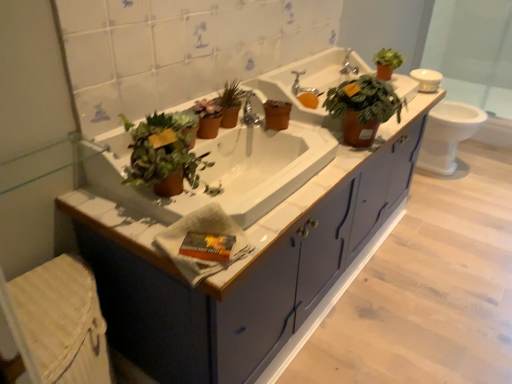
Image resolution: width=512 pixels, height=384 pixels. I want to click on white textured hand towel at center, so click(202, 231).

Identify the location of matte brown pot at center. (163, 138).

You are a GUI agent. You are given a task and a screenshot of the screen. Output one action in this format:
    pyautogui.click(x=<x>, y=<y>)
    Task: Click on the matte blue cabinet at center
    The image size is (512, 384).
    Given the screenshot: What is the action you would take?
    pyautogui.click(x=279, y=294)

Describe the element at coordinates (207, 118) in the screenshot. I see `green matte plant at center, the 2th houseplant in the front-to-back sequence` at that location.

Locate an element on the screen. The width and height of the screenshot is (512, 384). silver metallic faucet at center, the first faucet from the left is located at coordinates pos(302,87).

Does point (295, 160) come farther from viewer compared to point (206, 267)?

Yes, it is behind point (206, 267).

From a real-world perspective, who is located higher, white glossy sink at center, which is the 1th sink in front-to-back order, or white textured hand towel at center?

white textured hand towel at center, from a real-world perspective.

Is white glossy sink at center, which is the 1th sink in front-to-back order, thinner than white textured hand towel at center?

No, white glossy sink at center, which is the 1th sink in front-to-back order, is not thinner than white textured hand towel at center.

From the image's perspective, which is above, white glossy sink at center, which ranks as the second sink in back-to-front order, or white textured hand towel at center?

white glossy sink at center, which ranks as the second sink in back-to-front order, appears higher in the image.

Would you say matte blue cabinet at center is inside or outside matte blue cabinet at center?

matte blue cabinet at center is outside matte blue cabinet at center.

Is matte blue cabinet at center touching matte blue cabinet at center?

Yes, matte blue cabinet at center is in contact with matte blue cabinet at center.

How different are the orientations of matte blue cabinet at center and matte blue cabinet at center in degrees?

They differ by 0.00384 degrees in their facing directions.

Is matte blue cabinet at center smaller than matte blue cabinet at center?

Correct, matte blue cabinet at center occupies less space than matte blue cabinet at center.

Could matte blue cabinet at center be considered to be inside white glossy sink at center, which is the 1th sink in front-to-back order?

No.

Is white glossy sink at center, which is the 1th sink in front-to-back order, in front of or behind matte blue cabinet at center in the image?

white glossy sink at center, which is the 1th sink in front-to-back order, is in front of matte blue cabinet at center.

Is the surface of white glossy sink at center, which ranks as the second sink in back-to-front order, in direct contact with matte blue cabinet at center?

No, white glossy sink at center, which ranks as the second sink in back-to-front order, is not with matte blue cabinet at center.

Is white glossy sink at center, which ranks as the second sink in back-to-front order, in front of or behind matte brown pot at center, which is counted as the second houseplant, starting from the back, in the image?

white glossy sink at center, which ranks as the second sink in back-to-front order, is positioned closer to the viewer than matte brown pot at center, which is counted as the second houseplant, starting from the back.

From the image's perspective, which houseplant is the 3rd one above the white glossy sink at center, which ranks as the second sink in back-to-front order? Please provide its 2D coordinates.

[(230, 103)]

Considering the sizes of objects white glossy sink at center, which ranks as the second sink in back-to-front order, and matte brown pot at center, which is counted as the second houseplant, starting from the back, in the image provided, who is bigger, white glossy sink at center, which ranks as the second sink in back-to-front order, or matte brown pot at center, which is counted as the second houseplant, starting from the back,?

white glossy sink at center, which ranks as the second sink in back-to-front order.

Is white glossy sink at center, which is the 1th sink in front-to-back order, thinner than matte brown pot at center, which ranks as the third houseplant in right-to-left order?

In fact, white glossy sink at center, which is the 1th sink in front-to-back order, might be wider than matte brown pot at center, which ranks as the third houseplant in right-to-left order.

Which point is more distant from viewer, [346,93] or [393,64]?

The point [393,64] is farther from the camera.

Is matte terracotta pot at upper right, positioned as the third houseplant in left-to-right order, beside green matte plant at upper right, the 4th houseplant viewed from the front?

matte terracotta pot at upper right, positioned as the third houseplant in left-to-right order, and green matte plant at upper right, the 4th houseplant viewed from the front, are not in contact.

Considering the relative sizes of matte terracotta pot at upper right, placed as the 2th houseplant when sorted from right to left, and green matte plant at upper right, the first houseplant viewed from the back, in the image provided, is matte terracotta pot at upper right, placed as the 2th houseplant when sorted from right to left, shorter than green matte plant at upper right, the first houseplant viewed from the back,?

In fact, matte terracotta pot at upper right, placed as the 2th houseplant when sorted from right to left, may be taller than green matte plant at upper right, the first houseplant viewed from the back.

From a real-world perspective, between matte terracotta pot at upper right, placed as the 2th houseplant when sorted from right to left, and green matte plant at upper right, the 4th houseplant viewed from the front, who is vertically higher?

In real-world perspective, matte terracotta pot at upper right, placed as the 2th houseplant when sorted from right to left, is above.

From the image's perspective, is silver metallic faucet at upper center, which is the 1th faucet from top to bottom, over matte brown pot at center?

Yes, from the image's perspective, silver metallic faucet at upper center, which is the 1th faucet from top to bottom, is above matte brown pot at center.

Which point is more forward, (x=351, y=71) or (x=166, y=129)?

The point (x=166, y=129) is more forward.

Are silver metallic faucet at upper center, which is the 1th faucet from top to bottom, and matte brown pot at center located far from each other?

silver metallic faucet at upper center, which is the 1th faucet from top to bottom, is positioned a significant distance from matte brown pot at center.

Which is behind, white glossy sink at center, which ranks as the second sink in back-to-front order, or matte blue cabinet at center?

white glossy sink at center, which ranks as the second sink in back-to-front order, is further away from the camera.

Is matte blue cabinet at center located within white glossy sink at center, which ranks as the second sink in back-to-front order?

No, matte blue cabinet at center is located outside of white glossy sink at center, which ranks as the second sink in back-to-front order.

This screenshot has width=512, height=384. Identify the location of sink on the left of matte blue cabinet at center. (224, 171).

Considering the sizes of objects white glossy sink at center, which ranks as the second sink in back-to-front order, and matte blue cabinet at center in the image provided, who is bigger, white glossy sink at center, which ranks as the second sink in back-to-front order, or matte blue cabinet at center?

Bigger between the two is matte blue cabinet at center.

This screenshot has height=384, width=512. I want to click on the 1st sink behind the white textured hand towel at center, counting from the anchor's position, so click(x=224, y=171).

Find the location of a particular element. The width and height of the screenshot is (512, 384). bathroom cabinet above the matte blue cabinet at center (from the image's perspective) is located at coordinates (244, 265).

From the image, which object appears to be farther from matte brown pot at center, green matte plant at center, placed as the fourth houseplant when sorted from right to left, or white textured hand towel at center?

green matte plant at center, placed as the fourth houseplant when sorted from right to left, is positioned further to the anchor matte brown pot at center.

Looking at the image, which one is located closer to matte brown pot at center, which ranks as the third houseplant in right-to-left order, silver metallic faucet at upper center, which is the 1th faucet from back to front, or white glossy sink at center, which is the 1th sink in front-to-back order?

Among the two, white glossy sink at center, which is the 1th sink in front-to-back order, is located nearer to matte brown pot at center, which ranks as the third houseplant in right-to-left order.

Based on their spatial positions, is green matte plant at upper right, the 1th houseplant in the right-to-left sequence, or green matte plant at center, which ranks as the first houseplant in left-to-right order, further from matte blue cabinet at center?

Based on the image, green matte plant at upper right, the 1th houseplant in the right-to-left sequence, appears to be further to matte blue cabinet at center.

In the scene shown: Estimate the real-world distances between objects in this image. Which object is further from matte brown pot at center, white glossy sink at center, which is the 1th sink in front-to-back order, or matte terracotta pot at upper right, which ranks as the 1th houseplant in front-to-back order?

Based on the image, matte terracotta pot at upper right, which ranks as the 1th houseplant in front-to-back order, appears to be further to matte brown pot at center.

Based on their spatial positions, is white glossy toilet at right or matte terracotta pot at upper right, marked as the 4th houseplant in a back-to-front arrangement, further from green matte plant at upper right, the 1th houseplant in the right-to-left sequence?

white glossy toilet at right.

From the image, which object appears to be nearer to matte terracotta pot at upper right, marked as the 4th houseplant in a back-to-front arrangement, silver metallic faucet at center, positioned as the 2th faucet in top-to-bottom order, or white glossy sink at center, which ranks as the second sink in back-to-front order?

The object closer to matte terracotta pot at upper right, marked as the 4th houseplant in a back-to-front arrangement, is white glossy sink at center, which ranks as the second sink in back-to-front order.

Considering their positions, is matte brown pot at center positioned closer to green matte plant at upper right, the first houseplant viewed from the back, than white glossy toilet at right?

white glossy toilet at right is closer to green matte plant at upper right, the first houseplant viewed from the back.

Which object lies further to the anchor point matte blue cabinet at center, silver metallic faucet at upper center, which appears as the 2th faucet when viewed from the front, or matte brown pot at center, which is counted as the second houseplant, starting from the back?

silver metallic faucet at upper center, which appears as the 2th faucet when viewed from the front, is further to matte blue cabinet at center.

This screenshot has height=384, width=512. In order to click on hand towel between matte ceramic sink at center, the 1th sink in the back-to-front sequence, and matte blue cabinet at center, in the vertical direction in this screenshot , I will do `click(202, 231)`.

The width and height of the screenshot is (512, 384). I want to click on sink between white glossy sink at center, which is the 1th sink in front-to-back order, and silver metallic faucet at upper center, which is the 1th faucet from back to front, from front to back, so click(x=311, y=82).

At what (x,y) coordinates should I click in order to perform the action: click on houseplant located between matte brown pot at center, which ranks as the third houseplant in right-to-left order, and green matte plant at upper right, which is counted as the fourth houseplant, starting from the left, in the left-right direction. Please return your answer as a coordinate pair (x, y). The width and height of the screenshot is (512, 384). Looking at the image, I should click on (362, 108).

The width and height of the screenshot is (512, 384). Find the location of `bathroom cabinet located between white textured hand towel at center and matte brown pot at center, which is the 2th houseplant in left-to-right order, in the depth direction`. bathroom cabinet located between white textured hand towel at center and matte brown pot at center, which is the 2th houseplant in left-to-right order, in the depth direction is located at coordinates (244, 265).